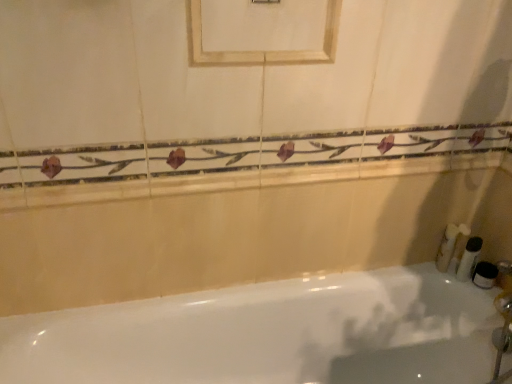
Where is `unoccupied area in front of white matte toothbrushes at right, which is the third toiletry from right to left`? This screenshot has width=512, height=384. unoccupied area in front of white matte toothbrushes at right, which is the third toiletry from right to left is located at coordinates (472, 286).